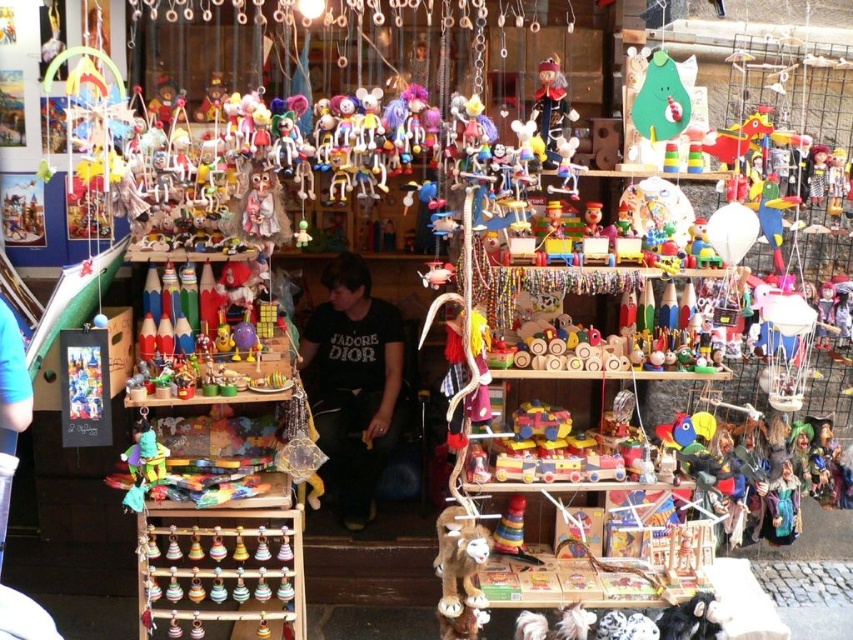
Question: Among these points, which one is farthest from the camera?

Choices:
 (A) (456, 522)
 (B) (387, 419)

Answer: (B)

Question: Is black cotton shirt at center thinner than brown plush reindeer at lower center?

Choices:
 (A) yes
 (B) no

Answer: (B)

Question: Is black cotton shirt at center above brown plush reindeer at lower center?

Choices:
 (A) no
 (B) yes

Answer: (B)

Question: Which point is closer to the camera?

Choices:
 (A) (347, 412)
 (B) (438, 529)

Answer: (B)

Question: Which object appears farthest from the camera in this image?

Choices:
 (A) black cotton shirt at center
 (B) brown plush reindeer at lower center

Answer: (A)

Question: Where is black cotton shirt at center located in relation to brown plush reindeer at lower center in the image?

Choices:
 (A) left
 (B) right

Answer: (A)